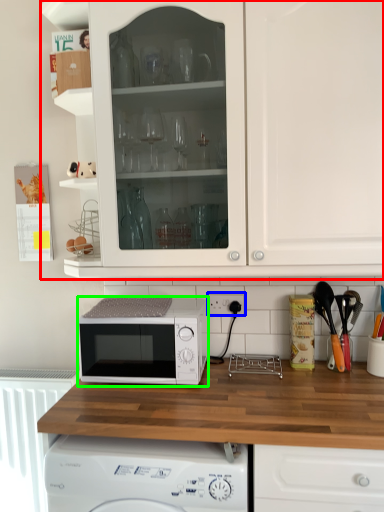
Question: Which object is the closest to the cabinetry (highlighted by a red box)? Choose among these: electric outlet (highlighted by a blue box) or microwave oven (highlighted by a green box).

Choices:
 (A) electric outlet
 (B) microwave oven

Answer: (B)